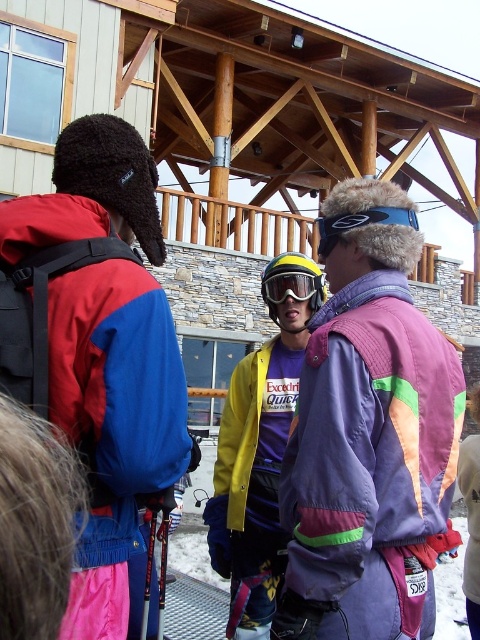
You are standing in a ski lodge and see two jackets hanging on adjacent hooks. The purple fleece jacket at center and the yellow matte jacket at center. Which jacket is physically closer to you?

The purple fleece jacket at center is closer to the viewer than the yellow matte jacket at center, so the purple fleece jacket at center is physically closer to you.

You are a photographer trying to capture a group photo of the yellow matte jacket at center and the clear plastic goggles at center. If your camera has a maximum focus range of 4 meters, will you be able to take a clear photo of both subjects at the same time?

The distance between the yellow matte jacket at center and the clear plastic goggles at center is 4.23 meters. Since the camera can only focus up to 4 meters, it won not be able to capture both subjects clearly in the same frame.

Based on the photo, you are standing at the entrance of the ski lodge and see the yellow matte jacket at center. If you walk straight ahead, will you move towards or away from the jacket?

The yellow matte jacket at center is located at point (255, 472), so walking straight ahead from the entrance would move you away from the jacket since the coordinates suggest it is positioned further back in the scene.